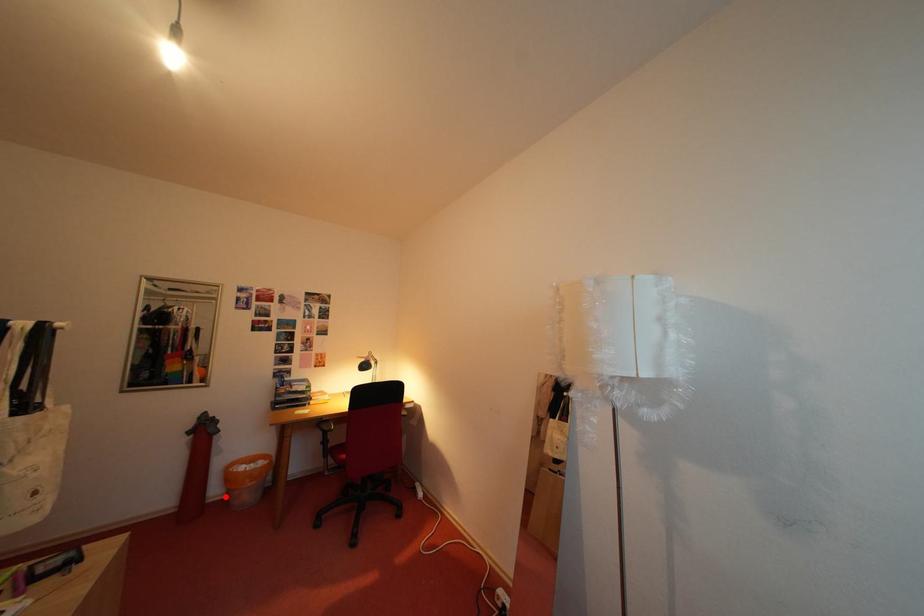
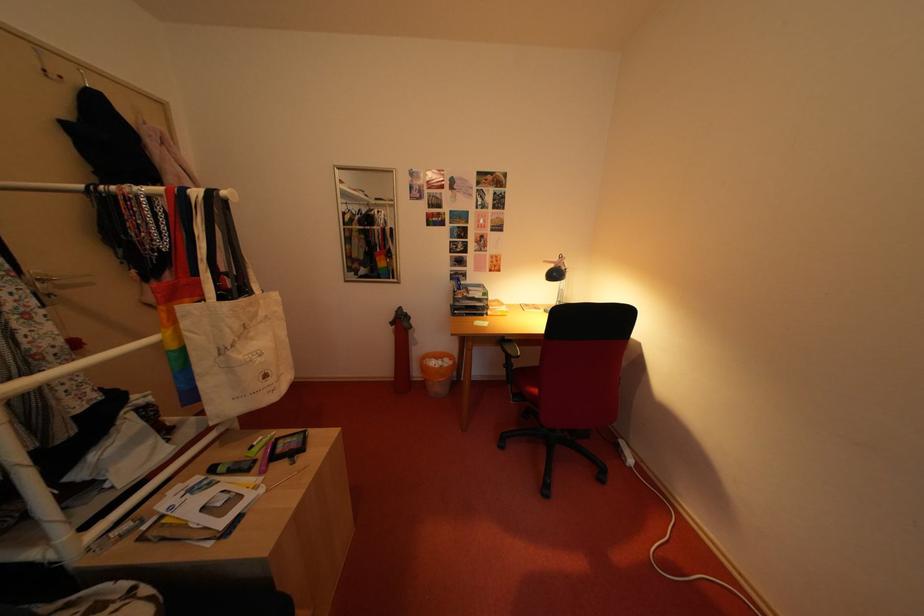
Question: I am providing you with two images of the same scene from different viewpoints. Given a red point in image1, look at the same physical point in image2. Is it:

Choices:
 (A) Closer to the viewpoint
 (B) Farther from the viewpoint

Answer: (B)